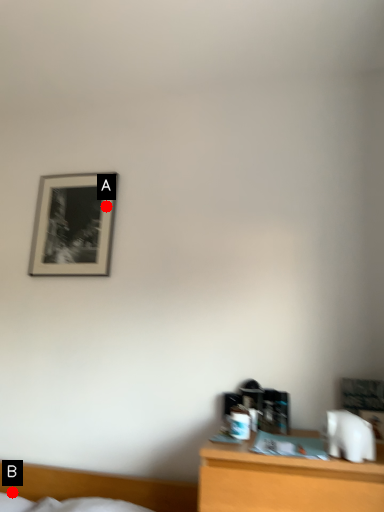
Question: Two points are circled on the image, labeled by A and B beside each circle. Which point is closer to the camera taking this photo?

Choices:
 (A) A is closer
 (B) B is closer

Answer: (B)